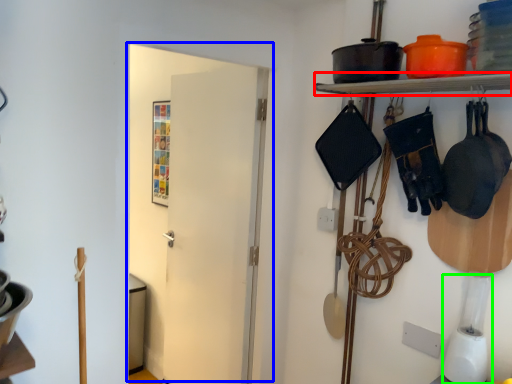
Question: Which is nearer to the shelf (highlighted by a red box)? door (highlighted by a blue box) or appliance (highlighted by a green box).

Choices:
 (A) door
 (B) appliance

Answer: (B)